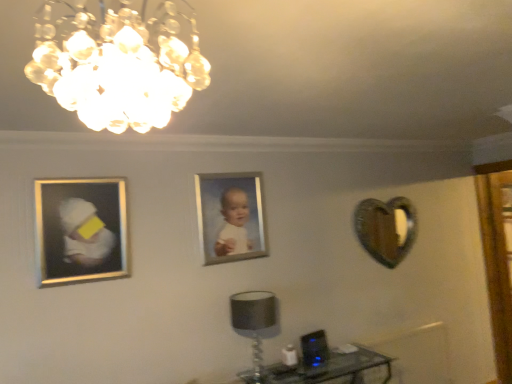
What are the coordinates of `clear glass chandelier at upper center` in the screenshot? It's located at (118, 66).

This screenshot has width=512, height=384. I want to click on silver/metallic picture frame at left, which is counted as the first picture frame, starting from the front, so click(x=81, y=229).

Find the location of a particular element. The image size is (512, 384). matte black lampshade at lower center is located at coordinates (253, 325).

Describe the element at coordinates (253, 325) in the screenshot. I see `matte black lampshade at lower center` at that location.

Describe the element at coordinates (231, 216) in the screenshot. I see `silver metallic picture frame at center, the 1th picture frame viewed from the right` at that location.

What is the approximate height of silver metallic picture frame at center, the first picture frame viewed from the back?

→ 23.43 inches.

Find the location of a particular element. clear glass chandelier at upper center is located at coordinates tap(118, 66).

Who is more distant, metallic heart-shaped mirror at right or silver metallic picture frame at center, the 1th picture frame viewed from the right?

metallic heart-shaped mirror at right.

In terms of size, does metallic heart-shaped mirror at right appear bigger or smaller than silver metallic picture frame at center, the 2th picture frame viewed from the front?

Clearly, metallic heart-shaped mirror at right is larger in size than silver metallic picture frame at center, the 2th picture frame viewed from the front.

Locate an element on the screen. The height and width of the screenshot is (384, 512). the 2nd picture frame positioned above the metallic heart-shaped mirror at right (from a real-world perspective) is located at coordinates (231, 216).

Is matte black lampshade at lower center taller or shorter than metallic heart-shaped mirror at right?

Considering their sizes, matte black lampshade at lower center has less height than metallic heart-shaped mirror at right.

Which is behind, point (269, 298) or point (377, 240)?

Point (377, 240)

Is matte black lampshade at lower center to the left of metallic heart-shaped mirror at right from the viewer's perspective?

Indeed, matte black lampshade at lower center is positioned on the left side of metallic heart-shaped mirror at right.

Does matte black lampshade at lower center turn towards metallic heart-shaped mirror at right?

No, matte black lampshade at lower center is not facing towards metallic heart-shaped mirror at right.

Between point (117, 54) and point (105, 191), which one is positioned behind?

Positioned behind is point (105, 191).

Is clear glass chandelier at upper center positioned in front of silver/metallic picture frame at left, acting as the second picture frame starting from the right?

Yes, it is.

Considering the sizes of clear glass chandelier at upper center and silver/metallic picture frame at left, acting as the second picture frame starting from the right, in the image, is clear glass chandelier at upper center wider or thinner than silver/metallic picture frame at left, acting as the second picture frame starting from the right,?

Clearly, clear glass chandelier at upper center has more width compared to silver/metallic picture frame at left, acting as the second picture frame starting from the right.

Does clear glass chandelier at upper center have a greater height compared to silver/metallic picture frame at left, which is counted as the first picture frame, starting from the front?

In fact, clear glass chandelier at upper center may be shorter than silver/metallic picture frame at left, which is counted as the first picture frame, starting from the front.

From the picture: How much distance is there between silver metallic picture frame at center, the 1th picture frame viewed from the right, and clear glass chandelier at upper center?

silver metallic picture frame at center, the 1th picture frame viewed from the right, and clear glass chandelier at upper center are 2.06 meters apart from each other.

Is silver metallic picture frame at center, positioned as the 2th picture frame in left-to-right order, turned away from clear glass chandelier at upper center?

No, clear glass chandelier at upper center is not at the back of silver metallic picture frame at center, positioned as the 2th picture frame in left-to-right order.

Considering the relative sizes of silver metallic picture frame at center, the 1th picture frame viewed from the right, and clear glass chandelier at upper center in the image provided, is silver metallic picture frame at center, the 1th picture frame viewed from the right, thinner than clear glass chandelier at upper center?

Yes, silver metallic picture frame at center, the 1th picture frame viewed from the right, is thinner than clear glass chandelier at upper center.

Considering the relative sizes of silver metallic picture frame at center, the 2th picture frame viewed from the front, and matte black lampshade at lower center in the image provided, is silver metallic picture frame at center, the 2th picture frame viewed from the front, smaller than matte black lampshade at lower center?

Indeed, silver metallic picture frame at center, the 2th picture frame viewed from the front, has a smaller size compared to matte black lampshade at lower center.

Is silver metallic picture frame at center, the 2th picture frame viewed from the front, surrounding matte black lampshade at lower center?

Actually, matte black lampshade at lower center is outside silver metallic picture frame at center, the 2th picture frame viewed from the front.

Who is taller, silver metallic picture frame at center, the 1th picture frame viewed from the right, or matte black lampshade at lower center?

silver metallic picture frame at center, the 1th picture frame viewed from the right, is taller.

Considering the relative positions of silver metallic picture frame at center, the first picture frame viewed from the back, and matte black lampshade at lower center in the image provided, is silver metallic picture frame at center, the first picture frame viewed from the back, to the right of matte black lampshade at lower center from the viewer's perspective?

No, silver metallic picture frame at center, the first picture frame viewed from the back, is not to the right of matte black lampshade at lower center.

Is silver/metallic picture frame at left, which is counted as the first picture frame, starting from the left, to the left of silver metallic picture frame at center, the 1th picture frame viewed from the right, from the viewer's perspective?

Yes.

Is point (44, 219) closer to viewer compared to point (268, 255)?

That is True.

Does silver/metallic picture frame at left, which is counted as the first picture frame, starting from the front, have a lesser width compared to silver metallic picture frame at center, the 1th picture frame viewed from the right?

No.

Could transparent glass table at lower right be considered to be inside clear glass chandelier at upper center?

Definitely not — transparent glass table at lower right is not inside clear glass chandelier at upper center.

What's the angular difference between clear glass chandelier at upper center and transparent glass table at lower right's facing directions?

They differ by 96.6 degrees in their facing directions.

Image resolution: width=512 pixels, height=384 pixels. In order to click on table behind the clear glass chandelier at upper center in this screenshot , I will do point(325,370).

I want to click on the 2nd picture frame directly above the metallic heart-shaped mirror at right (from a real-world perspective), so click(231, 216).

Where is `table lamp below the metallic heart-shaped mirror at right (from the image's perspective)`? The width and height of the screenshot is (512, 384). table lamp below the metallic heart-shaped mirror at right (from the image's perspective) is located at coordinates (253, 325).

Based on their spatial positions, is silver metallic picture frame at center, positioned as the 2th picture frame in left-to-right order, or clear glass chandelier at upper center closer to metallic heart-shaped mirror at right?

The object closer to metallic heart-shaped mirror at right is silver metallic picture frame at center, positioned as the 2th picture frame in left-to-right order.

Considering their positions, is transparent glass table at lower right positioned further to silver metallic picture frame at center, the 1th picture frame viewed from the right, than clear glass chandelier at upper center?

clear glass chandelier at upper center is further to silver metallic picture frame at center, the 1th picture frame viewed from the right.

Considering their positions, is clear glass chandelier at upper center positioned closer to transparent glass table at lower right than silver/metallic picture frame at left, which is counted as the first picture frame, starting from the left?

Among the two, silver/metallic picture frame at left, which is counted as the first picture frame, starting from the left, is located nearer to transparent glass table at lower right.

Looking at this image, when comparing their distances from transparent glass table at lower right, does metallic heart-shaped mirror at right or matte black lampshade at lower center seem closer?

matte black lampshade at lower center is closer to transparent glass table at lower right.

Considering their positions, is matte black lampshade at lower center positioned closer to silver metallic picture frame at center, positioned as the 2th picture frame in left-to-right order, than metallic heart-shaped mirror at right?

The object closer to silver metallic picture frame at center, positioned as the 2th picture frame in left-to-right order, is matte black lampshade at lower center.

Estimate the real-world distances between objects in this image. Which object is further from silver metallic picture frame at center, positioned as the 2th picture frame in left-to-right order, matte black lampshade at lower center or silver/metallic picture frame at left, marked as the 2th picture frame in a back-to-front arrangement?

Among the two, silver/metallic picture frame at left, marked as the 2th picture frame in a back-to-front arrangement, is located further to silver metallic picture frame at center, positioned as the 2th picture frame in left-to-right order.

From the image, which object appears to be farther from clear glass chandelier at upper center, silver metallic picture frame at center, the 1th picture frame viewed from the right, or transparent glass table at lower right?

Among the two, transparent glass table at lower right is located further to clear glass chandelier at upper center.

Looking at the image, which one is located further to matte black lampshade at lower center, silver metallic picture frame at center, the 2th picture frame viewed from the front, or metallic heart-shaped mirror at right?

The object further to matte black lampshade at lower center is metallic heart-shaped mirror at right.

Find the location of `picture frame between clear glass chandelier at upper center and matte black lampshade at lower center in the front-back direction`. picture frame between clear glass chandelier at upper center and matte black lampshade at lower center in the front-back direction is located at coordinates (81, 229).

Find the location of a particular element. Image resolution: width=512 pixels, height=384 pixels. picture frame between clear glass chandelier at upper center and silver metallic picture frame at center, the 1th picture frame viewed from the right, in the front-back direction is located at coordinates (81, 229).

This screenshot has width=512, height=384. In order to click on table lamp between silver/metallic picture frame at left, which is counted as the first picture frame, starting from the left, and metallic heart-shaped mirror at right in this screenshot , I will do click(253, 325).

At what (x,y) coordinates should I click in order to perform the action: click on table lamp positioned between clear glass chandelier at upper center and metallic heart-shaped mirror at right from near to far. Please return your answer as a coordinate pair (x, y). The width and height of the screenshot is (512, 384). Looking at the image, I should click on (253, 325).